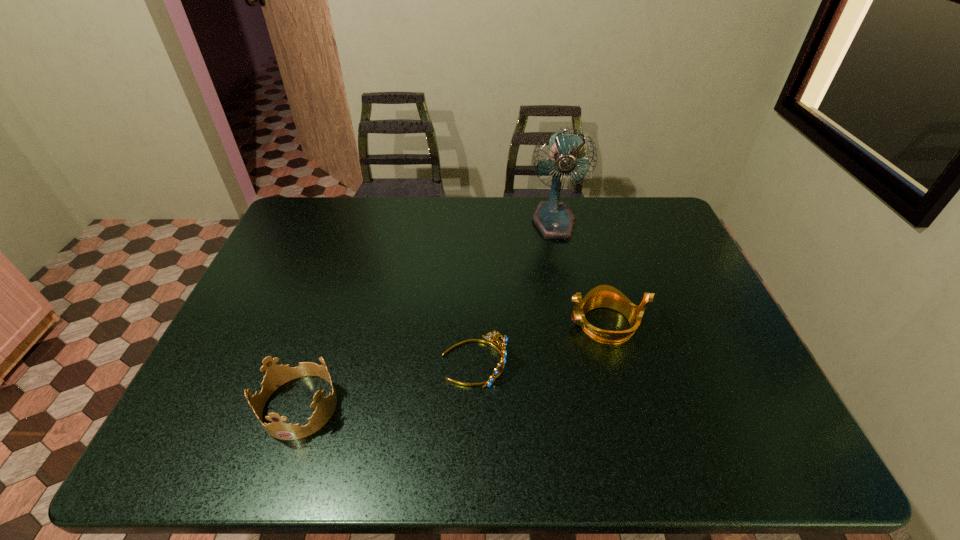
The image size is (960, 540). Identify the location of fan. point(554,220).

I want to click on the farthest object, so click(x=554, y=220).

Image resolution: width=960 pixels, height=540 pixels. Find the location of `the rightmost tiara`. the rightmost tiara is located at coordinates (607, 296).

Find the location of a particular element. the leftmost object is located at coordinates (276, 375).

Locate an element on the screen. Image resolution: width=960 pixels, height=540 pixels. the third object from right to left is located at coordinates (501, 346).

In order to click on vacant area situated 0.350m in front of the fan where the wind blows in this screenshot , I will do `click(574, 319)`.

You are a GUI agent. You are given a task and a screenshot of the screen. Output one action in this format:
    pyautogui.click(x=<x>, y=<y>)
    Task: Click on the vacant space located 0.140m at the front emblem of the rightmost tiara
    This screenshot has width=960, height=540.
    Given the screenshot: What is the action you would take?
    pyautogui.click(x=515, y=324)

Locate an element on the screen. The image size is (960, 540). vacant space located at the front emblem of the rightmost tiara is located at coordinates (521, 324).

In order to click on free space located 0.050m at the front emblem of the rightmost tiara in this screenshot , I will do coord(548,324).

Where is `free space located 0.050m on the front-facing side of the second object from left to right`? This screenshot has width=960, height=540. free space located 0.050m on the front-facing side of the second object from left to right is located at coordinates (527, 362).